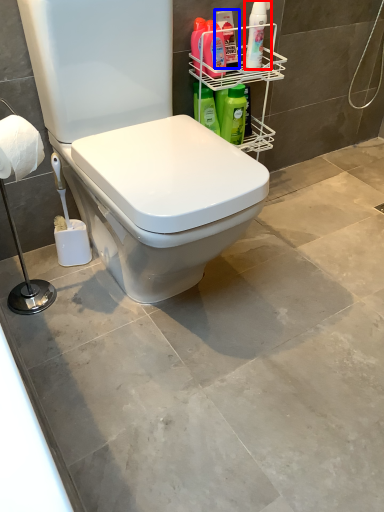
Question: Which of the following is the closest to the observer, cleaning product (highlighted by a red box) or cleaning product (highlighted by a blue box)?

Choices:
 (A) cleaning product
 (B) cleaning product

Answer: (A)